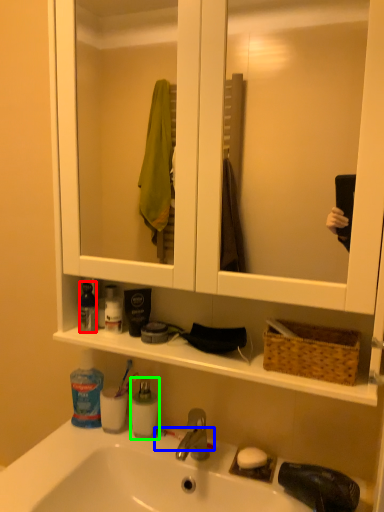
Question: Which object is positioned farthest from cleaning product (highlighted by a red box)? Select from toothbrush (highlighted by a blue box) and mouthwash (highlighted by a green box).

Choices:
 (A) toothbrush
 (B) mouthwash

Answer: (A)